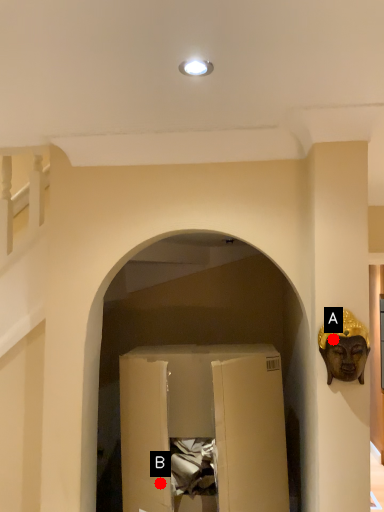
Question: Two points are circled on the image, labeled by A and B beside each circle. Which point is closer to the camera?

Choices:
 (A) A is closer
 (B) B is closer

Answer: (A)